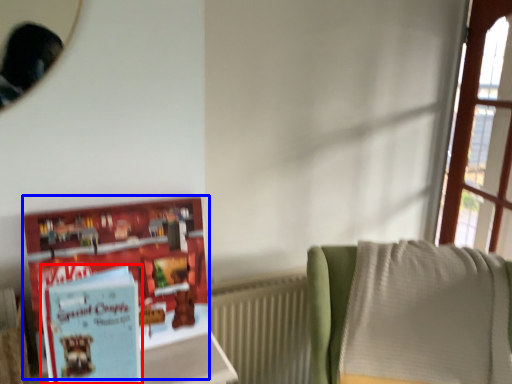
Question: Which object is closer to the camera taking this photo, paperback book (highlighted by a red box) or book (highlighted by a blue box)?

Choices:
 (A) paperback book
 (B) book

Answer: (A)